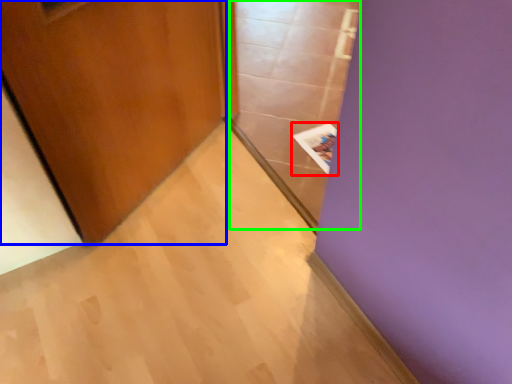
Question: Which object is the closest to the magazine (highlighted by a red box)? Choose among these: door (highlighted by a blue box) or glass door (highlighted by a green box).

Choices:
 (A) door
 (B) glass door

Answer: (B)